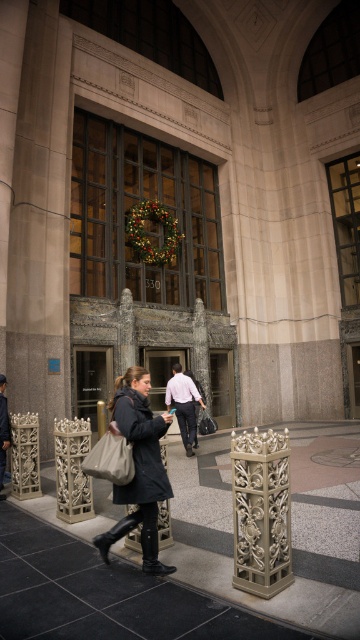
You are standing at the entrance of the building and want to walk towards the two points marked on the pavement. Which point, point [123,426] or point [3,387], is closer to you?

Point [123,426] is closer to the viewer than point [3,387], so you should walk towards point [123,426] first.